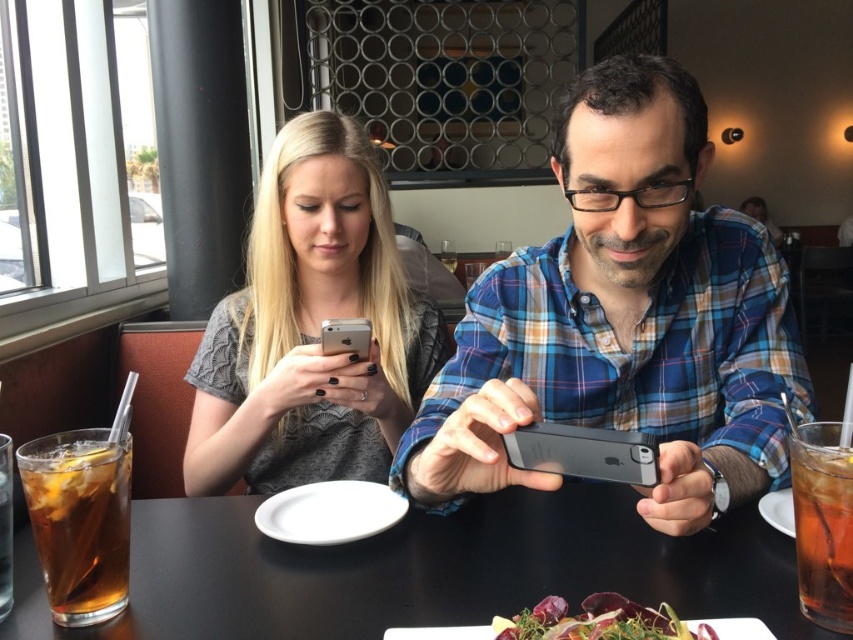
Can you confirm if matte silver phone at center is positioned to the right of brown translucent glass at table center?

No, matte silver phone at center is not to the right of brown translucent glass at table center.

Consider the image. Does matte silver phone at center appear under brown translucent glass at table center?

No, matte silver phone at center is not below brown translucent glass at table center.

Is point (410, 291) closer to camera compared to point (849, 630)?

No, (410, 291) is behind (849, 630).

The image size is (853, 640). In order to click on matte silver phone at center in this screenshot , I will do `click(311, 326)`.

Between brown translucent glass at table center and green leafy salad at lower center, which one has less height?

Standing shorter between the two is green leafy salad at lower center.

Can you confirm if brown translucent glass at table center is thinner than green leafy salad at lower center?

Correct, brown translucent glass at table center's width is less than green leafy salad at lower center's.

What do you see at coordinates (822, 531) in the screenshot? The width and height of the screenshot is (853, 640). I see `brown translucent glass at table center` at bounding box center [822, 531].

Find the location of `brown translucent glass at table center`. brown translucent glass at table center is located at coordinates (822, 531).

Between black glossy table at center and translucent glass drink at lower left, which one has more height?

Standing taller between the two is translucent glass drink at lower left.

Who is more distant from viewer, (x=200, y=508) or (x=102, y=496)?

Point (x=200, y=508)

Who is more forward, (579,518) or (51,448)?

Point (51,448) is in front.

This screenshot has width=853, height=640. I want to click on black glossy table at center, so click(x=422, y=570).